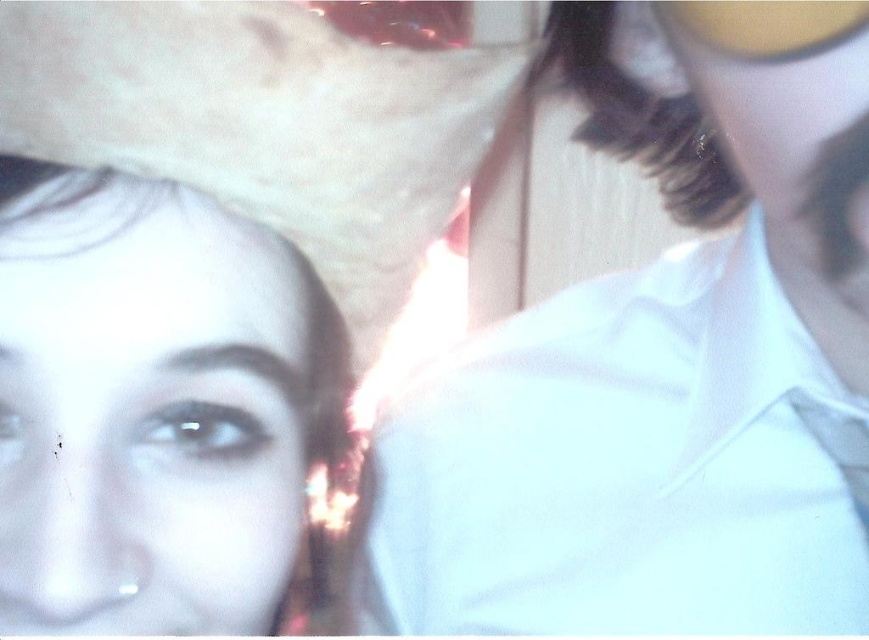
You are taking a selfie with two friends. You notice a white smooth shirt at upper right and a white felt cowboy hat at upper left in the frame. Which object is positioned higher in the image?

The white smooth shirt at upper right is taller than the white felt cowboy hat at upper left in the image.

Consider the image. You are taking a selfie with two people. You notice a white smooth shirt at upper right and a smooth skin face at lower left. Which object is located to the right of the other?

The white smooth shirt at upper right is positioned on the right side of smooth skin face at lower left.

You are taking a selfie with two friends. You notice the white smooth shirt at upper right and the white felt cowboy hat at upper left. Which object is closer to you in the photo?

The white smooth shirt at upper right is closer to you than the white felt cowboy hat at upper left.